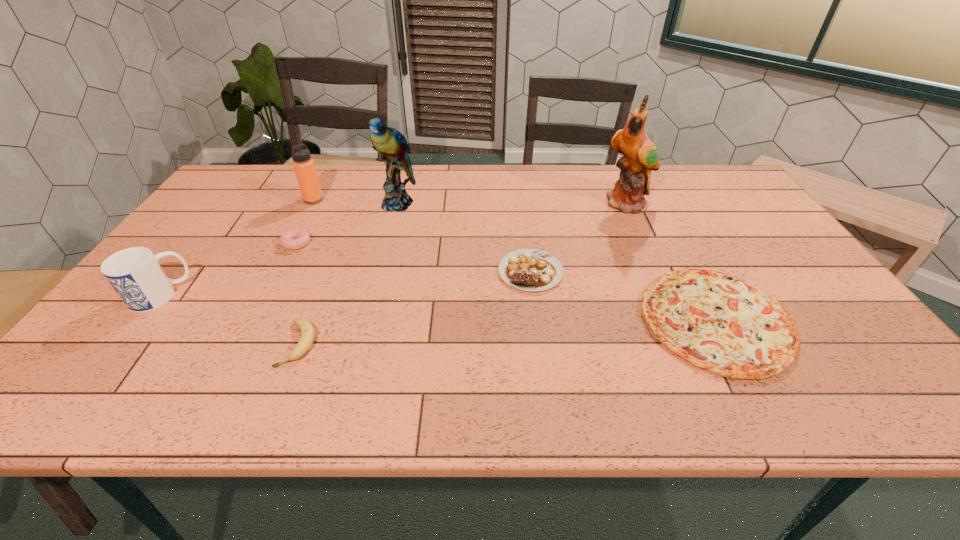
You are a GUI agent. You are given a task and a screenshot of the screen. Output one action in this format:
    pyautogui.click(x=<x>, y=<y>)
    Task: Click on the free space between the thermos bottle and the doughnut
    This screenshot has height=540, width=960.
    Given the screenshot: What is the action you would take?
    pyautogui.click(x=305, y=221)

Locate an element on the screen. This screenshot has width=960, height=540. free point between the pizza and the sixth object from left to right is located at coordinates (623, 296).

Image resolution: width=960 pixels, height=540 pixels. Find the location of `vacant area that lies between the fourth object from left to right and the third object from right to left`. vacant area that lies between the fourth object from left to right and the third object from right to left is located at coordinates (415, 308).

The height and width of the screenshot is (540, 960). I want to click on vacant area between the third tallest object and the taller parrot, so click(x=470, y=202).

The width and height of the screenshot is (960, 540). I want to click on free space that is in between the banana and the third tallest object, so click(x=306, y=272).

At what (x,y) coordinates should I click in order to perform the action: click on vacant area that lies between the doughnut and the mug. Please return your answer as a coordinate pair (x, y). Image resolution: width=960 pixels, height=540 pixels. Looking at the image, I should click on (228, 269).

Find the location of a particular element. free space between the sixth object from left to right and the doughnut is located at coordinates (414, 257).

Where is `free point between the sixth object from left to right and the left parrot`? This screenshot has height=540, width=960. free point between the sixth object from left to right and the left parrot is located at coordinates (464, 238).

Select which object appears as the fourth closest to the tallest object. Please provide its 2D coordinates. Your answer should be formatted as a tuple, i.e. [(x, y)], where the tuple contains the x and y coordinates of a point satisfying the conditions above.

[(307, 337)]

In order to click on object identified as the seventh closest to the thermos bottle in this screenshot , I will do `click(718, 322)`.